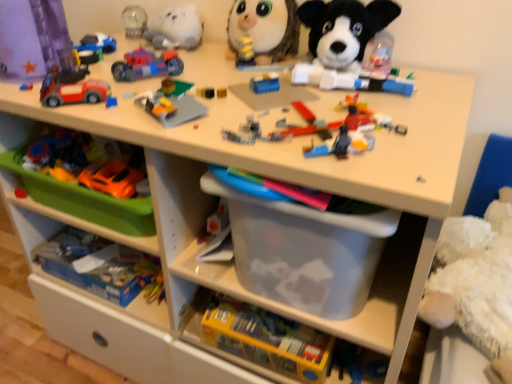
Locate an element on the screen. The width and height of the screenshot is (512, 384). vacant position to the left of matte plastic car at upper left, positioned as the 5th toy in bottom-to-top order is located at coordinates (25, 89).